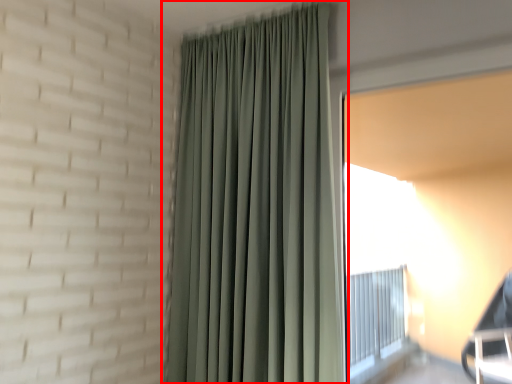
Question: From the image's perspective, where is curtain (annotated by the red box) located in relation to window screen in the image?

Choices:
 (A) above
 (B) below

Answer: (A)